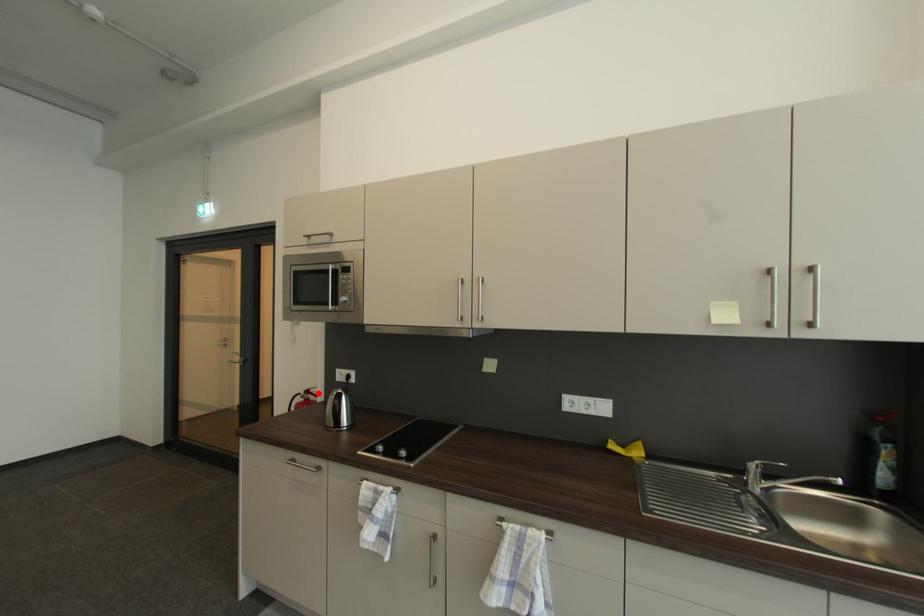
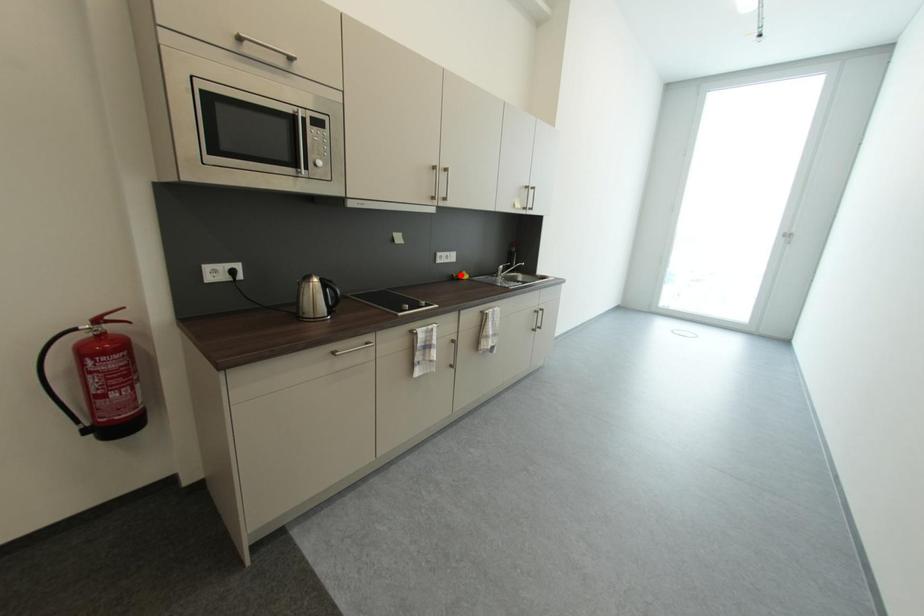
I am providing you with two images of the same scene from different viewpoints. A red point is marked on the first image and another point is marked on the second image. Is the marked point in image1 the same physical position as the marked point in image2?

No